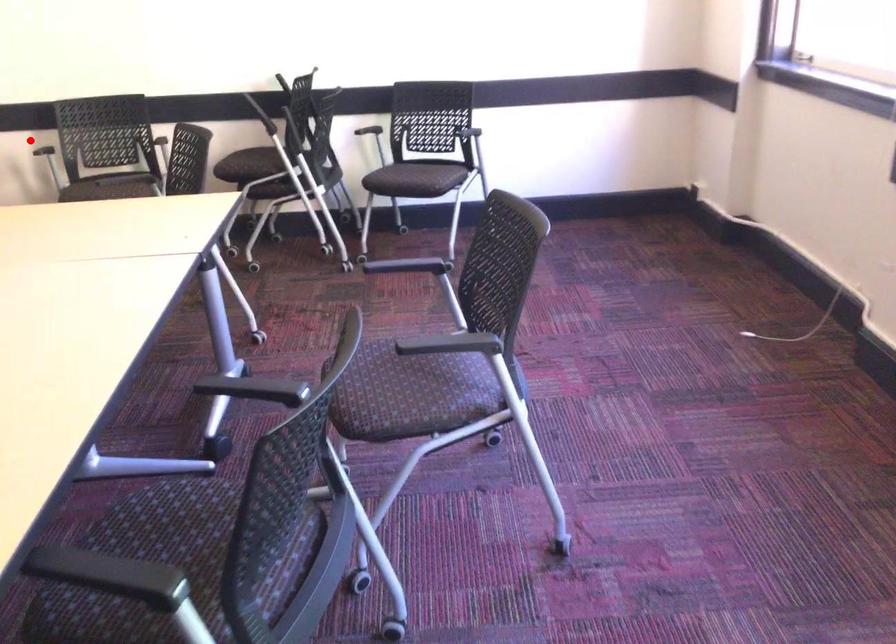
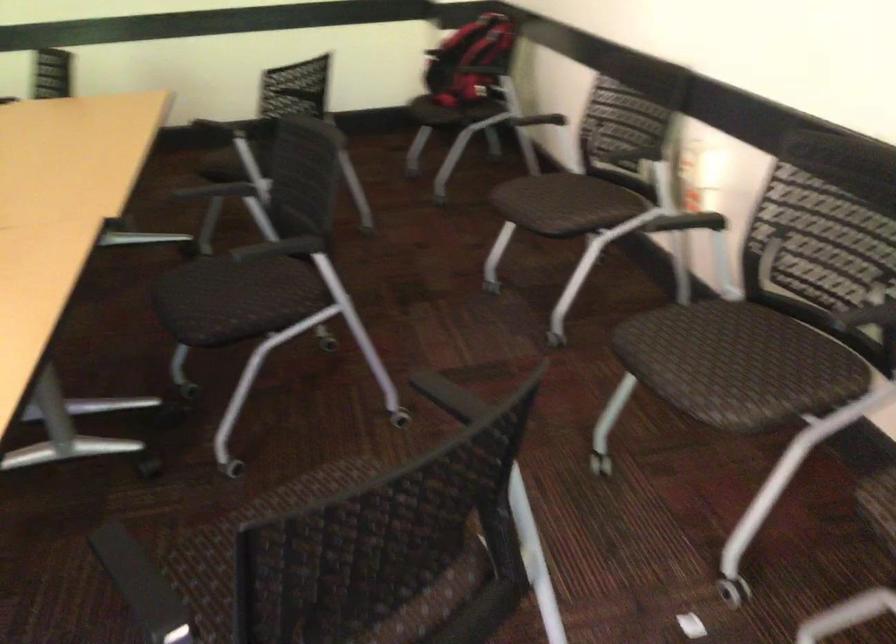
Question: I am providing you with two images of the same scene from different viewpoints. A red point is marked on the first image. At the location where the point appears in image 1, is it still visible in image 2?

Choices:
 (A) Yes
 (B) No

Answer: (B)